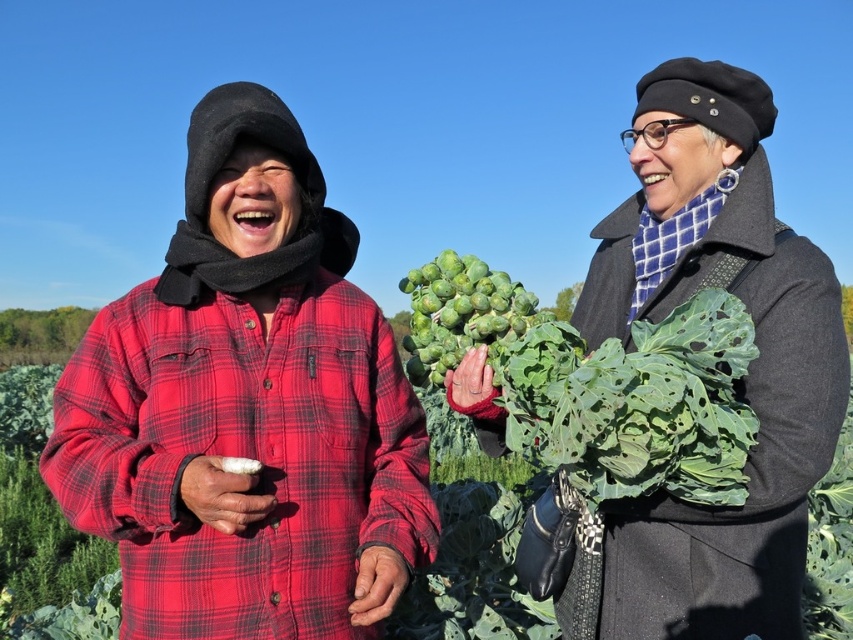
Question: Which of the following is the closest to the observer?

Choices:
 (A) (697, 413)
 (B) (314, 403)
 (C) (234, 458)
 (D) (469, 262)

Answer: (A)

Question: Is red plaid shirt at center closer to camera compared to white fluffy food at center?

Choices:
 (A) yes
 (B) no

Answer: (A)

Question: In this image, where is red plaid shirt at center located relative to green leafy vegetable at center?

Choices:
 (A) below
 (B) above

Answer: (B)

Question: Can you confirm if red plaid shirt at center is wider than green leafy vegetable at center?

Choices:
 (A) yes
 (B) no

Answer: (A)

Question: Which is farther from the red plaid shirt at center?

Choices:
 (A) green leafy vegetable at center
 (B) white fluffy food at center

Answer: (A)

Question: Among these points, which one is nearest to the camera?

Choices:
 (A) (434, 284)
 (B) (225, 472)

Answer: (B)